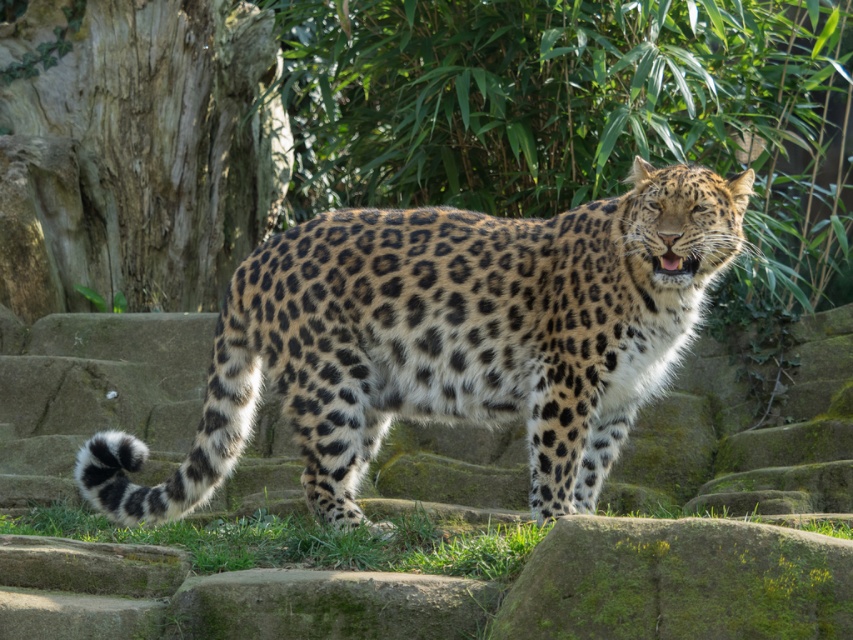
You are a wildlife photographer aiming to capture the spotted fur leopard at center and the green grass at lower center in the same frame. Based on their positions and sizes, which object should you focus on first to ensure both are in the frame?

The spotted fur leopard at center might be wider than green grass at lower center, so you should focus on the leopard first to ensure both fit in the frame.

Based on the scene description, can you determine which object is taller between the spotted fur leopard at center and the green grass at lower center?

The spotted fur leopard at center is taller than the green grass at lower center.

You are standing in a forest clearing and see the spotted fur leopard at center. If the leopard suddenly charges towards you at a speed of 60 km per hour, how many seconds will it take for the leopard to reach you?

The leopard and viewer are 6.91 meters apart. Converting 60 km per hour to meters per second equals 16.6667 mps. Dividing distance by speed gives 6.91 divided by 16.6667 equals approximately 0.415 seconds. Therefore, the leopard will reach you in about 0.42 seconds.